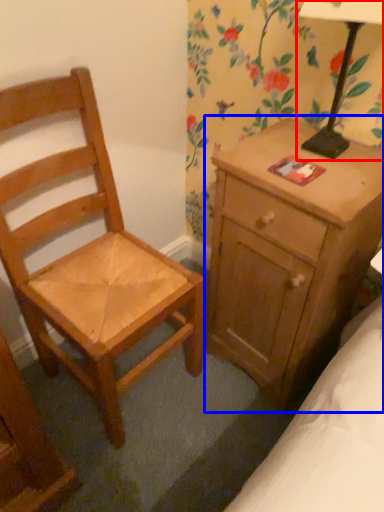
Question: Among these objects, which one is nearest to the camera, table lamp (highlighted by a red box) or nightstand (highlighted by a blue box)?

Choices:
 (A) table lamp
 (B) nightstand

Answer: (A)